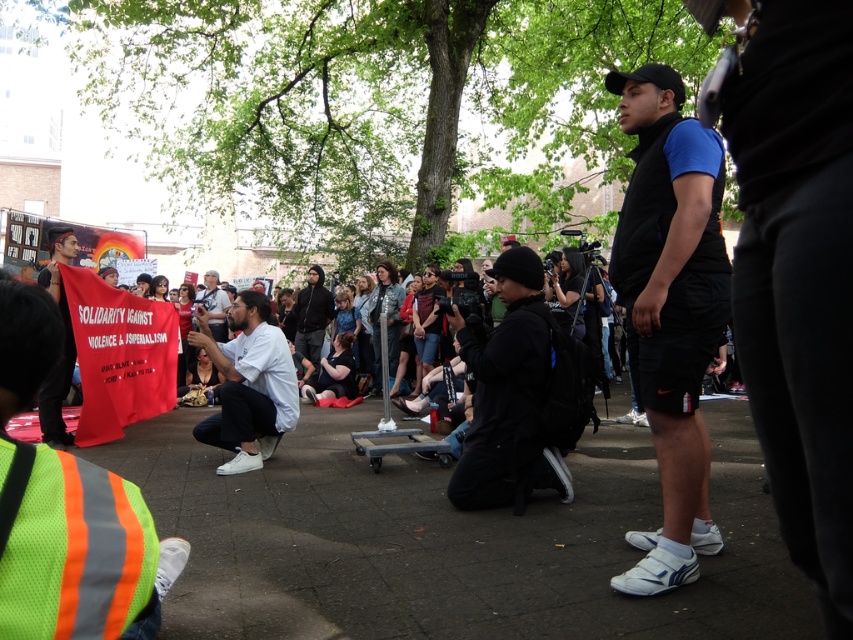
Question: Which object is positioned closest to the white matte shirt at center?

Choices:
 (A) white shirt at center
 (B) black matte jacket at center
 (C) blue fabric shirt at center

Answer: (B)

Question: Is blue fabric shirt at center further to the viewer compared to black matte jacket at center?

Choices:
 (A) yes
 (B) no

Answer: (B)

Question: Considering the relative positions of black matte jacket at center and white matte shirt at center in the image provided, where is black matte jacket at center located with respect to white matte shirt at center?

Choices:
 (A) below
 (B) above

Answer: (B)

Question: Which is nearer to the blue fabric shirt at center?

Choices:
 (A) black matte jacket at center
 (B) white shirt at center

Answer: (A)

Question: Which of the following is the farthest from the observer?

Choices:
 (A) white shirt at center
 (B) blue fabric shirt at center

Answer: (A)

Question: Is blue fabric shirt at center further to the viewer compared to black matte jacket at center?

Choices:
 (A) no
 (B) yes

Answer: (A)